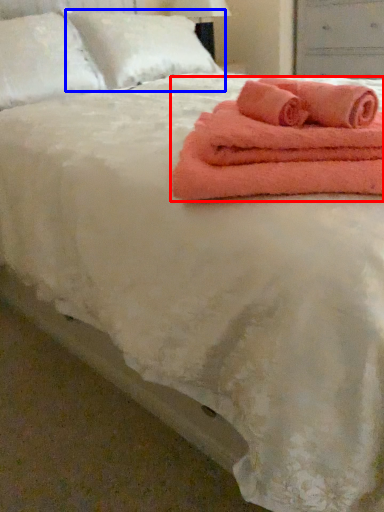
Question: Which point is further to the camera, towel (highlighted by a red box) or pillow (highlighted by a blue box)?

Choices:
 (A) towel
 (B) pillow

Answer: (B)